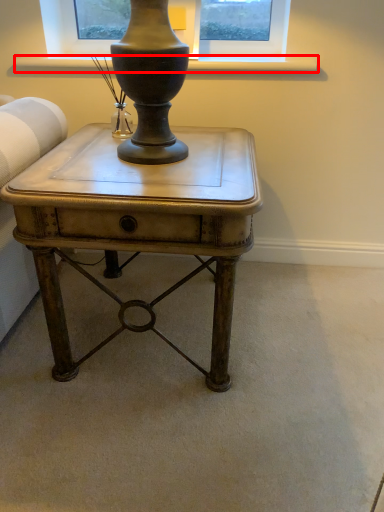
Question: From the image's perspective, considering the relative positions of window sill (annotated by the red box) and table in the image provided, where is window sill (annotated by the red box) located with respect to the staircase?

Choices:
 (A) below
 (B) above

Answer: (B)